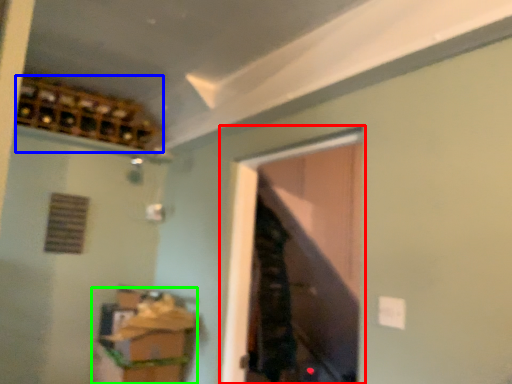
Question: Which object is positioned closest to window (highlighted by a red box)? Select from wine cabinet (highlighted by a blue box) and cabinetry (highlighted by a green box).

Choices:
 (A) wine cabinet
 (B) cabinetry

Answer: (B)